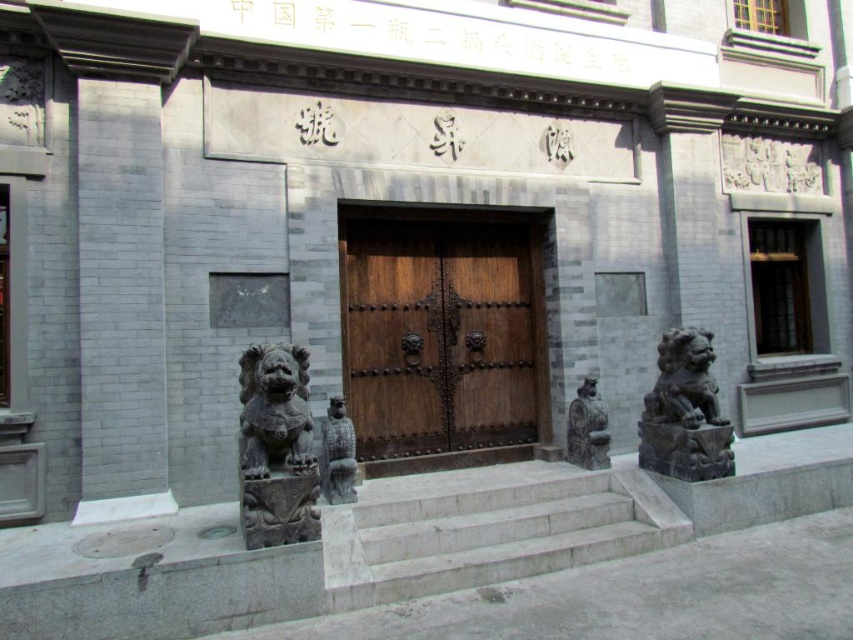
Which is behind, point (352, 428) or point (573, 397)?

Positioned behind is point (573, 397).

Consider the image. Between gray stone statue at center and stone statue at center, which one has less height?

Standing shorter between the two is gray stone statue at center.

Between point (351, 440) and point (596, 429), which one is positioned behind?

Positioned behind is point (596, 429).

This screenshot has width=853, height=640. What are the coordinates of `gray stone statue at center` in the screenshot? It's located at (337, 454).

Which of these two, dark gray stone lion at right or gray stone statue at center, stands taller?

dark gray stone lion at right is taller.

Is point (677, 396) behind point (345, 460)?

Yes, it is behind point (345, 460).

Identify the location of dark gray stone lion at right. This screenshot has height=640, width=853. (685, 412).

The image size is (853, 640). Describe the element at coordinates (685, 412) in the screenshot. I see `dark gray stone lion at right` at that location.

Is point (701, 472) more distant than point (570, 452)?

No.

This screenshot has width=853, height=640. In order to click on dark gray stone lion at right in this screenshot , I will do `click(685, 412)`.